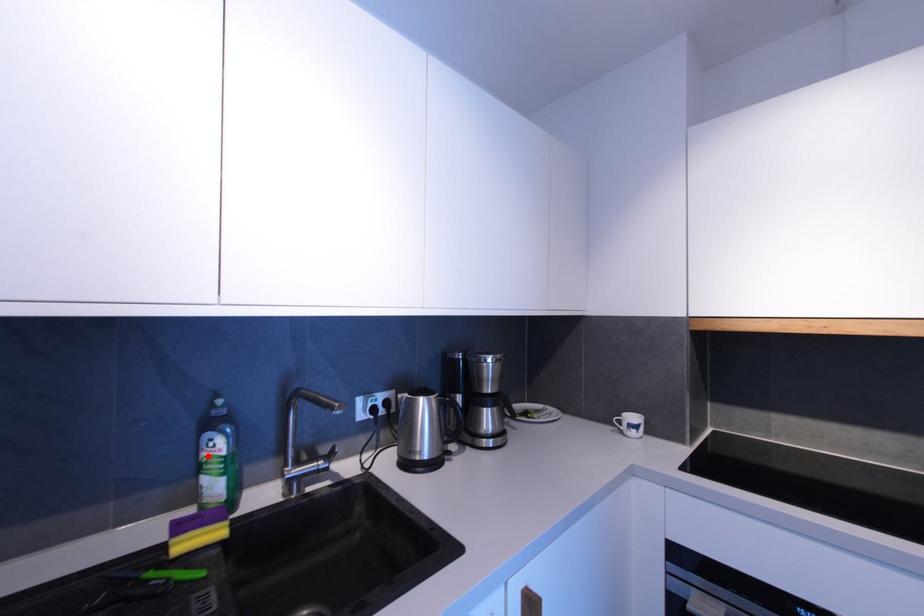
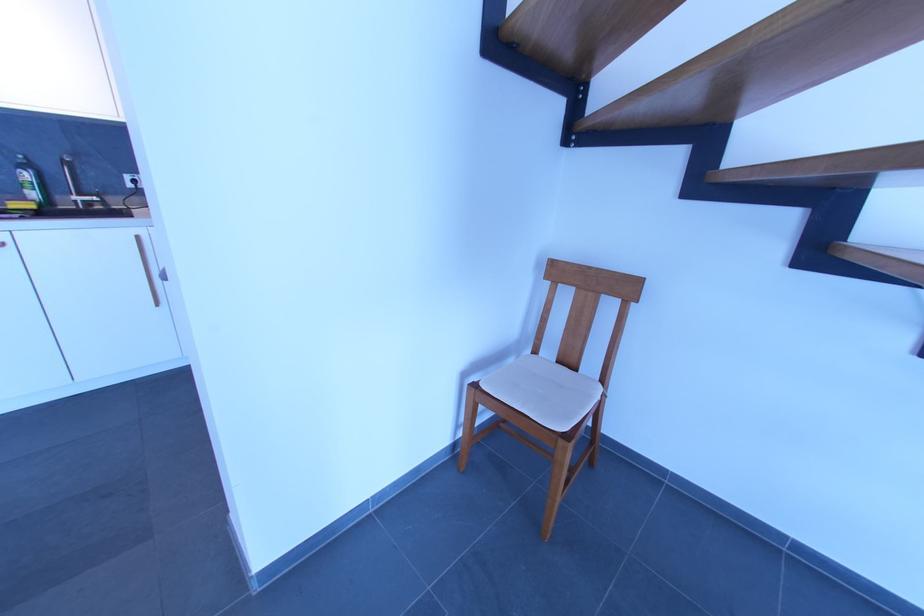
Where in the second image is the point corresponding to the highlighted location from the first image?

(26, 182)